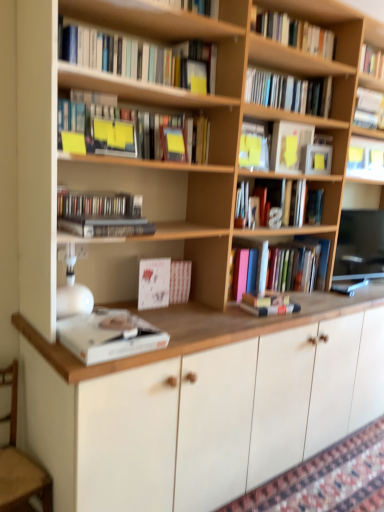
The width and height of the screenshot is (384, 512). Identify the location of free space above hardcover books at upper center, positioned as the 4th book in top-to-bottom order (from a real-world perspective). (140, 24).